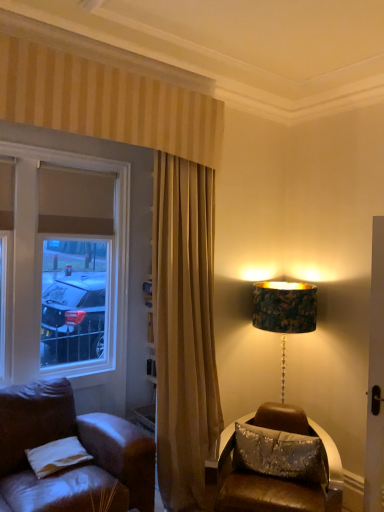
Question: Does white fabric pillow at lower left, the 2th pillow in the right-to-left sequence, lie behind sparkly silver pillow at lower right, the second pillow positioned from the left?

Choices:
 (A) no
 (B) yes

Answer: (A)

Question: Could you tell me if white fabric pillow at lower left, the 2th pillow in the right-to-left sequence, is turned towards sparkly silver pillow at lower right, which is the 1th pillow from right to left?

Choices:
 (A) yes
 (B) no

Answer: (B)

Question: Does white fabric pillow at lower left, the 2th pillow in the right-to-left sequence, have a larger size compared to sparkly silver pillow at lower right, the second pillow positioned from the left?

Choices:
 (A) no
 (B) yes

Answer: (A)

Question: From the image's perspective, is white fabric pillow at lower left, the 2th pillow in the right-to-left sequence, above sparkly silver pillow at lower right, which is the 1th pillow from right to left?

Choices:
 (A) yes
 (B) no

Answer: (B)

Question: Is white fabric pillow at lower left, arranged as the first pillow when viewed from the left, located outside sparkly silver pillow at lower right, which is the 1th pillow from right to left?

Choices:
 (A) yes
 (B) no

Answer: (A)

Question: Is matte glass window at left in front of or behind sparkly silver pillow at lower right, the second pillow positioned from the left, in the image?

Choices:
 (A) front
 (B) behind

Answer: (B)

Question: Considering the positions of point (120, 162) and point (243, 448), is point (120, 162) closer or farther from the camera than point (243, 448)?

Choices:
 (A) closer
 (B) farther

Answer: (B)

Question: Would you say matte glass window at left is to the left or to the right of sparkly silver pillow at lower right, the second pillow positioned from the left, in the picture?

Choices:
 (A) left
 (B) right

Answer: (A)

Question: Is matte glass window at left situated inside sparkly silver pillow at lower right, which is the 1th pillow from right to left, or outside?

Choices:
 (A) inside
 (B) outside

Answer: (B)

Question: Is sparkly silver pillow at lower right, the second pillow positioned from the left, in front of or behind white fabric pillow at lower left, arranged as the first pillow when viewed from the left, in the image?

Choices:
 (A) front
 (B) behind

Answer: (B)

Question: From the image's perspective, is sparkly silver pillow at lower right, which is the 1th pillow from right to left, positioned above or below white fabric pillow at lower left, arranged as the first pillow when viewed from the left?

Choices:
 (A) above
 (B) below

Answer: (A)

Question: Is sparkly silver pillow at lower right, which is the 1th pillow from right to left, to the left or to the right of white fabric pillow at lower left, the 2th pillow in the right-to-left sequence, in the image?

Choices:
 (A) right
 (B) left

Answer: (A)

Question: Looking at their shapes, would you say sparkly silver pillow at lower right, the second pillow positioned from the left, is wider or thinner than white fabric pillow at lower left, the 2th pillow in the right-to-left sequence?

Choices:
 (A) wide
 (B) thin

Answer: (B)

Question: Is point (59, 461) closer or farther from the camera than point (36, 195)?

Choices:
 (A) farther
 (B) closer

Answer: (B)

Question: Considering the positions of white fabric pillow at lower left, arranged as the first pillow when viewed from the left, and matte glass window at left in the image, is white fabric pillow at lower left, arranged as the first pillow when viewed from the left, bigger or smaller than matte glass window at left?

Choices:
 (A) big
 (B) small

Answer: (B)